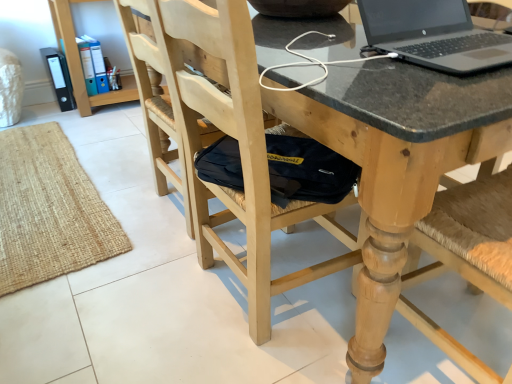
Where is `free space in front of matte black folders at upper left`? free space in front of matte black folders at upper left is located at coordinates pos(110,124).